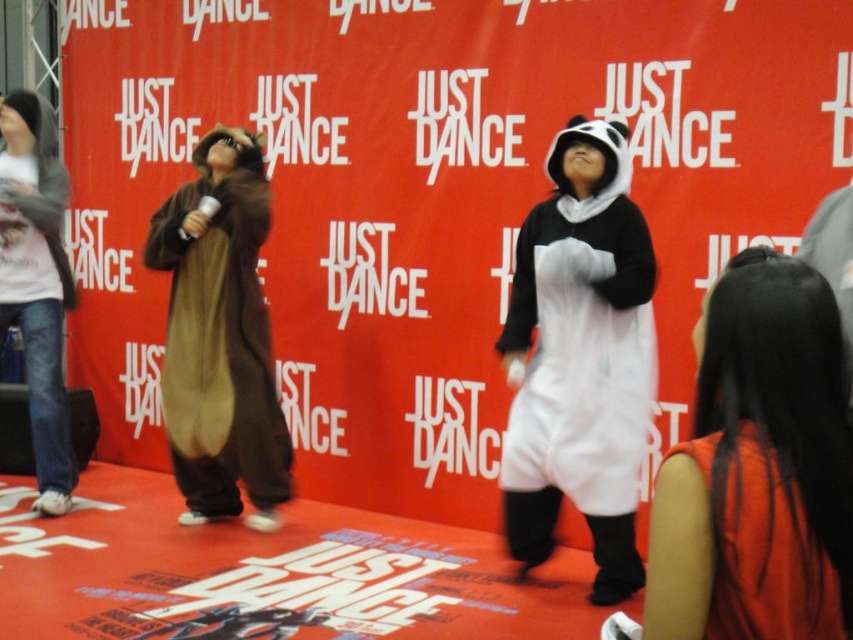
Question: Is brown furry onesie at left smaller than jeans at left?

Choices:
 (A) yes
 (B) no

Answer: (B)

Question: Estimate the real-world distances between objects in this image. Which object is farther from the jeans at left?

Choices:
 (A) silky orange dress at lower right
 (B) brown furry onesie at left

Answer: (A)

Question: Estimate the real-world distances between objects in this image. Which object is farther from the white plush panda at center?

Choices:
 (A) jeans at left
 (B) silky orange dress at lower right
 (C) brown furry onesie at left

Answer: (A)

Question: Considering the real-world distances, which object is closest to the jeans at left?

Choices:
 (A) brown furry onesie at left
 (B) silky orange dress at lower right
 (C) white plush panda at center

Answer: (A)

Question: Does white plush panda at center appear under jeans at left?

Choices:
 (A) no
 (B) yes

Answer: (B)

Question: Considering the relative positions of white plush panda at center and brown furry onesie at left in the image provided, where is white plush panda at center located with respect to brown furry onesie at left?

Choices:
 (A) below
 (B) above

Answer: (A)